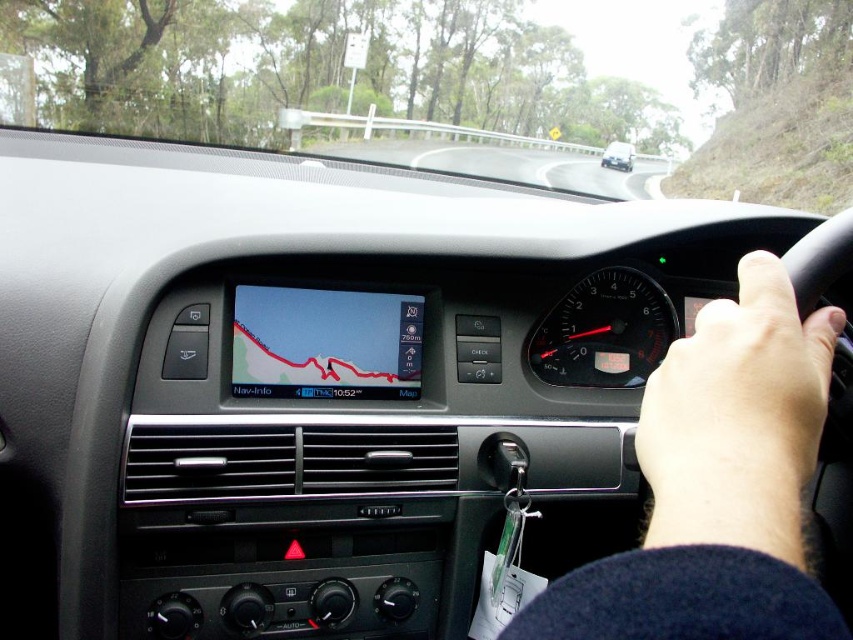
Question: Does smooth skin hand at center right have a greater width compared to matte black sedan at center?

Choices:
 (A) no
 (B) yes

Answer: (A)

Question: Which point is farther to the camera?

Choices:
 (A) skinny white hand at center right
 (B) smooth skin hand at center right

Answer: (A)

Question: Among these points, which one is farthest from the camera?

Choices:
 (A) (776, 328)
 (B) (482, 147)
 (C) (804, 353)
 (D) (625, 172)

Answer: (B)

Question: Estimate the real-world distances between objects in this image. Which object is farther from the matte black sedan at center?

Choices:
 (A) transparent glass windshield at upper center
 (B) skinny white hand at center right
 (C) smooth skin hand at center right

Answer: (C)

Question: Observing the image, what is the correct spatial positioning of skinny white hand at center right in reference to matte black sedan at center?

Choices:
 (A) left
 (B) right

Answer: (A)

Question: Where is transparent glass windshield at upper center located in relation to smooth skin hand at center right in the image?

Choices:
 (A) above
 (B) below

Answer: (A)